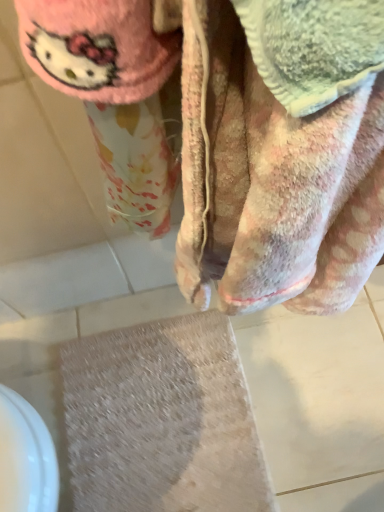
You are a GUI agent. You are given a task and a screenshot of the screen. Output one action in this format:
    pyautogui.click(x=<x>, y=<y>)
    Task: Click on the beige textured bath mat at lower center
    
    Given the screenshot: What is the action you would take?
    pyautogui.click(x=162, y=419)

Measure the distance between beige textured bath mat at lower center and camera.

beige textured bath mat at lower center and camera are 32.64 inches apart.

The image size is (384, 512). What do you see at coordinates (162, 419) in the screenshot?
I see `beige textured bath mat at lower center` at bounding box center [162, 419].

In order to face beige textured bath mat at lower center, should I rotate leftwards or rightwards?

To align with it, rotate left about 4.733°.

Locate an element on the screen. The height and width of the screenshot is (512, 384). beige textured bath mat at lower center is located at coordinates (162, 419).